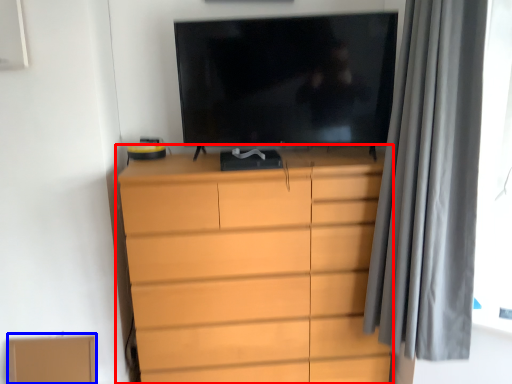
Question: Among these objects, which one is farthest to the camera, chest of drawers (highlighted by a red box) or cardboard box (highlighted by a blue box)?

Choices:
 (A) chest of drawers
 (B) cardboard box

Answer: (B)